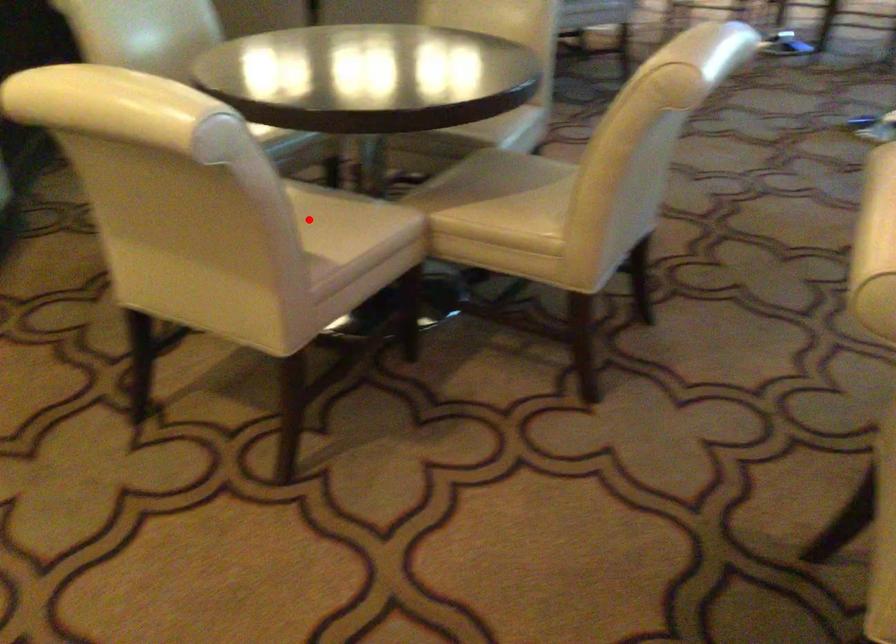
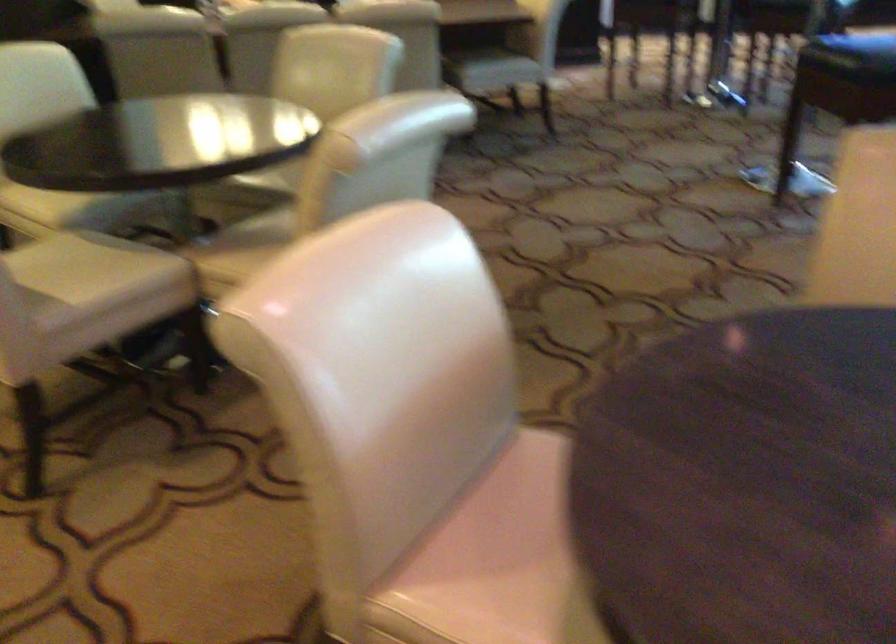
Question: I am providing you with two images of the same scene from different viewpoints. In image1, a red point is highlighted. Considering the same 3D point in image2, which of the following is correct?

Choices:
 (A) It is closer
 (B) It is farther

Answer: (B)